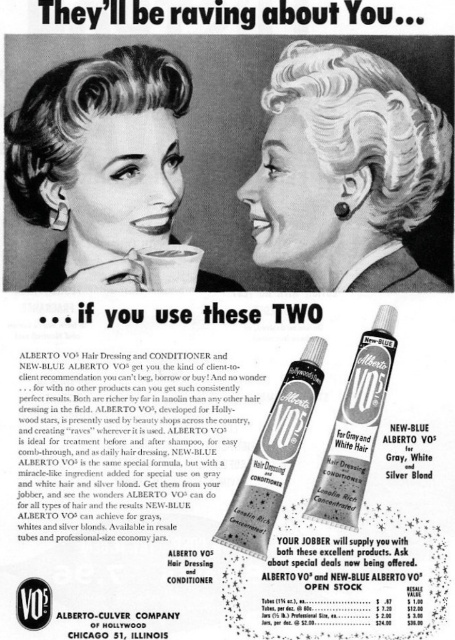
Question: Is the position of white curly hair at upper center more distant than that of white matte cup at center?

Choices:
 (A) yes
 (B) no

Answer: (B)

Question: Which object is farther from the camera taking this photo?

Choices:
 (A) silver metallic hair conditioner at center
 (B) white matte cup at center

Answer: (B)

Question: Is sleek blonde hair at center smaller than white matte cup at center?

Choices:
 (A) no
 (B) yes

Answer: (A)

Question: Which object is positioned farthest from the sleek blonde hair at center?

Choices:
 (A) white curly hair at upper center
 (B) silver metallic hair conditioner at center
 (C) white matte cup at center

Answer: (B)

Question: Where is white curly hair at upper center located in relation to sleek blonde hair at center in the image?

Choices:
 (A) right
 (B) left

Answer: (A)

Question: Which point is closer to the camera taking this photo?

Choices:
 (A) (221, 531)
 (B) (107, 77)

Answer: (A)